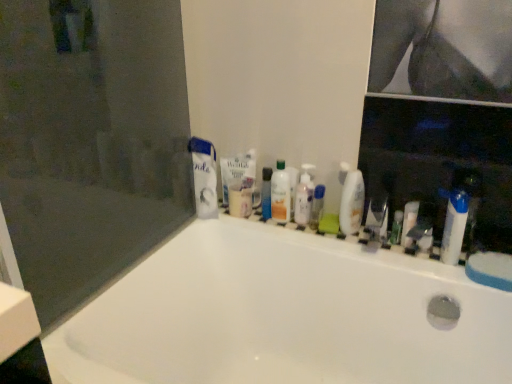
In the scene shown: Measure the distance between white matte toothpaste at upper left, the first toothpaste positioned from the left, and camera.

white matte toothpaste at upper left, the first toothpaste positioned from the left, is 1.38 meters away from camera.

Image resolution: width=512 pixels, height=384 pixels. What do you see at coordinates (421, 229) in the screenshot? I see `matte white faucet at right` at bounding box center [421, 229].

Describe the element at coordinates (409, 222) in the screenshot. The height and width of the screenshot is (384, 512). I see `white plastic toothbrush at center, which appears as the 2th toiletry when viewed from the right` at that location.

Image resolution: width=512 pixels, height=384 pixels. What are the coordinates of `white glossy ledge at upper center` in the screenshot? It's located at (365, 238).

The image size is (512, 384). What are the coordinates of `transparent glass screen door at upper left` in the screenshot? It's located at (90, 140).

I want to click on metallic silver razor at center, which appears as the 4th toiletry when viewed from the right, so click(x=377, y=218).

What is the approximate width of translucent plastic bottles at center, the fifth toiletry positioned from the right?

translucent plastic bottles at center, the fifth toiletry positioned from the right, is 3.09 inches wide.

You are a GUI agent. You are given a task and a screenshot of the screen. Output one action in this format:
    pyautogui.click(x=<x>, y=<y>)
    Task: Click on the white matte toothpaste at upper left, the first toothpaste positioned from the left
    Image resolution: width=512 pixels, height=384 pixels.
    Given the screenshot: What is the action you would take?
    pyautogui.click(x=204, y=177)

Is metallic silver razor at center, which appears as the 4th toiletry when viewed from the right, not inside transparent plastic bottle at center, positioned as the 2th mouthwash in left-to-right order?

That's correct, metallic silver razor at center, which appears as the 4th toiletry when viewed from the right, is outside of transparent plastic bottle at center, positioned as the 2th mouthwash in left-to-right order.

Is point (383, 219) closer to viewer compared to point (322, 189)?

Yes, point (383, 219) is in front of point (322, 189).

Locate an element on the screen. This screenshot has height=384, width=512. the 1st toiletry below the transparent plastic bottle at center, placed as the second mouthwash when sorted from right to left (from the image's perspective) is located at coordinates (377, 218).

Based on the photo, which is more to the left, white plastic toothbrush at center, which appears as the 2th toiletry when viewed from the right, or green matte bottle at center, marked as the third toiletry in a right-to-left arrangement?

From the viewer's perspective, green matte bottle at center, marked as the third toiletry in a right-to-left arrangement, appears more on the left side.

Does white plastic toothbrush at center, which appears as the 2th toiletry when viewed from the right, touch green matte bottle at center, positioned as the fourth toiletry in left-to-right order?

Yes, white plastic toothbrush at center, which appears as the 2th toiletry when viewed from the right, is next to green matte bottle at center, positioned as the fourth toiletry in left-to-right order.

How different are the orientations of white plastic toothbrush at center, which ranks as the 5th toiletry in left-to-right order, and green matte bottle at center, marked as the third toiletry in a right-to-left arrangement, in degrees?

The angular difference between white plastic toothbrush at center, which ranks as the 5th toiletry in left-to-right order, and green matte bottle at center, marked as the third toiletry in a right-to-left arrangement, is 0.00102 degrees.

Which of these two, white plastic toothbrush at center, which appears as the 2th toiletry when viewed from the right, or green matte bottle at center, positioned as the fourth toiletry in left-to-right order, is wider?

With larger width is white plastic toothbrush at center, which appears as the 2th toiletry when viewed from the right.

Considering the relative sizes of white plastic toothbrush at center, which appears as the 2th toiletry when viewed from the right, and white matte toothpaste at upper left, which ranks as the second toothpaste in right-to-left order, in the image provided, is white plastic toothbrush at center, which appears as the 2th toiletry when viewed from the right, smaller than white matte toothpaste at upper left, which ranks as the second toothpaste in right-to-left order,?

Correct, white plastic toothbrush at center, which appears as the 2th toiletry when viewed from the right, occupies less space than white matte toothpaste at upper left, which ranks as the second toothpaste in right-to-left order.

Considering the relative positions of white plastic toothbrush at center, which ranks as the 5th toiletry in left-to-right order, and white matte toothpaste at upper left, the first toothpaste positioned from the left, in the image provided, is white plastic toothbrush at center, which ranks as the 5th toiletry in left-to-right order, to the right of white matte toothpaste at upper left, the first toothpaste positioned from the left, from the viewer's perspective?

Yes, white plastic toothbrush at center, which ranks as the 5th toiletry in left-to-right order, is to the right of white matte toothpaste at upper left, the first toothpaste positioned from the left.

Considering the relative sizes of white plastic toothbrush at center, which appears as the 2th toiletry when viewed from the right, and white matte toothpaste at upper left, which ranks as the second toothpaste in right-to-left order, in the image provided, is white plastic toothbrush at center, which appears as the 2th toiletry when viewed from the right, shorter than white matte toothpaste at upper left, which ranks as the second toothpaste in right-to-left order,?

Correct, white plastic toothbrush at center, which appears as the 2th toiletry when viewed from the right, is not as tall as white matte toothpaste at upper left, which ranks as the second toothpaste in right-to-left order.

Is white matte toothpaste at upper left, the first toothpaste positioned from the left, at the back of white plastic toothbrush at center, which ranks as the 5th toiletry in left-to-right order?

That's not correct — white plastic toothbrush at center, which ranks as the 5th toiletry in left-to-right order, is not looking away from white matte toothpaste at upper left, the first toothpaste positioned from the left.

Does point (342, 223) lie in front of point (237, 342)?

Yes, point (342, 223) is closer to viewer.

From a real-world perspective, who is located lower, white glossy mouthwash at center, which is the 1th mouthwash in right-to-left order, or white glossy bathtub at center?

From a 3D spatial view, white glossy bathtub at center is below.

Does white glossy mouthwash at center, which is the 1th mouthwash in right-to-left order, touch white glossy bathtub at center?

white glossy mouthwash at center, which is the 1th mouthwash in right-to-left order, and white glossy bathtub at center are clearly separated.

Considering their positions, is white glossy mouthwash at center, acting as the third mouthwash starting from the left, located in front of or behind white glossy bathtub at center?

Clearly, white glossy mouthwash at center, acting as the third mouthwash starting from the left, is behind white glossy bathtub at center.

In the image, is transparent plastic bottle at center, positioned as the 2th mouthwash in left-to-right order, on the left side or the right side of white plastic toothbrush at center, which appears as the 2th toiletry when viewed from the right?

From the image, it's evident that transparent plastic bottle at center, positioned as the 2th mouthwash in left-to-right order, is to the left of white plastic toothbrush at center, which appears as the 2th toiletry when viewed from the right.

Consider the image. Is transparent plastic bottle at center, placed as the second mouthwash when sorted from right to left, further to the viewer compared to white plastic toothbrush at center, which ranks as the 5th toiletry in left-to-right order?

That is True.

Is transparent plastic bottle at center, placed as the second mouthwash when sorted from right to left, thinner than white plastic toothbrush at center, which appears as the 2th toiletry when viewed from the right?

Incorrect, the width of transparent plastic bottle at center, placed as the second mouthwash when sorted from right to left, is not less than that of white plastic toothbrush at center, which appears as the 2th toiletry when viewed from the right.

The height and width of the screenshot is (384, 512). There is a transparent plastic bottle at center, placed as the second mouthwash when sorted from right to left. Identify the location of the 2nd toiletry below it (from the image's perspective). (409, 222).

Which is correct: white plastic tube at right, which is the 6th toiletry in left-to-right order, is inside green matte bottle at center, positioned as the fourth toiletry in left-to-right order, or outside of it?

white plastic tube at right, which is the 6th toiletry in left-to-right order, cannot be found inside green matte bottle at center, positioned as the fourth toiletry in left-to-right order.

Looking at this image, considering the sizes of white plastic tube at right, which is the first toiletry from right to left, and green matte bottle at center, positioned as the fourth toiletry in left-to-right order, in the image, is white plastic tube at right, which is the first toiletry from right to left, bigger or smaller than green matte bottle at center, positioned as the fourth toiletry in left-to-right order,?

white plastic tube at right, which is the first toiletry from right to left, is bigger than green matte bottle at center, positioned as the fourth toiletry in left-to-right order.

Considering the relative sizes of white plastic tube at right, which is the first toiletry from right to left, and green matte bottle at center, positioned as the fourth toiletry in left-to-right order, in the image provided, is white plastic tube at right, which is the first toiletry from right to left, taller than green matte bottle at center, positioned as the fourth toiletry in left-to-right order,?

Yes, white plastic tube at right, which is the first toiletry from right to left, is taller than green matte bottle at center, positioned as the fourth toiletry in left-to-right order.

How different are the orientations of white plastic tube at right, which is the first toiletry from right to left, and green matte bottle at center, marked as the third toiletry in a right-to-left arrangement, in degrees?

72.8 degrees separate the facing orientations of white plastic tube at right, which is the first toiletry from right to left, and green matte bottle at center, marked as the third toiletry in a right-to-left arrangement.

Who is more distant, white glossy ledge at upper center or metallic silver razor at center, which appears as the 4th toiletry when viewed from the right?

metallic silver razor at center, which appears as the 4th toiletry when viewed from the right, is behind.

Looking at this image, could you tell me if white glossy ledge at upper center is facing metallic silver razor at center, which appears as the 4th toiletry when viewed from the right?

No, white glossy ledge at upper center is not aimed at metallic silver razor at center, which appears as the 4th toiletry when viewed from the right.

Does white glossy ledge at upper center touch metallic silver razor at center, acting as the 3th toiletry starting from the left?

No, white glossy ledge at upper center is not with metallic silver razor at center, acting as the 3th toiletry starting from the left.

At what (x,y) coordinates should I click in order to perform the action: click on ledge on the left side of metallic silver razor at center, acting as the 3th toiletry starting from the left. Please return your answer as a coordinate pair (x, y). Looking at the image, I should click on (365, 238).

At what (x,y) coordinates should I click in order to perform the action: click on mouthwash that is the 1st one when counting backward from the metallic silver razor at center, acting as the 3th toiletry starting from the left. Please return your answer as a coordinate pair (x, y). This screenshot has width=512, height=384. Looking at the image, I should click on (317, 206).

From a real-world perspective, which toiletry is the 1st one above the green matte bottle at center, positioned as the fourth toiletry in left-to-right order? Please provide its 2D coordinates.

[(409, 222)]

Based on the photo, when comparing their distances from green matte bottle at center, marked as the third toiletry in a right-to-left arrangement, does white matte toothpaste at upper center, which is counted as the first toothpaste, starting from the right, or translucent plastic mouthwash at center, which is the first mouthwash in left-to-right order, seem further?

white matte toothpaste at upper center, which is counted as the first toothpaste, starting from the right, is further to green matte bottle at center, marked as the third toiletry in a right-to-left arrangement.

When comparing their distances from transparent plastic bottle at center, placed as the second mouthwash when sorted from right to left, does white plastic tube at right, which is the first toiletry from right to left, or transparent glass screen door at upper left seem further?

Based on the image, transparent glass screen door at upper left appears to be further to transparent plastic bottle at center, placed as the second mouthwash when sorted from right to left.

Which object lies nearer to the anchor point white matte toothpaste at upper left, the first toothpaste positioned from the left, matte white faucet at right or metallic silver razor at center, which appears as the 4th toiletry when viewed from the right?

The object closer to white matte toothpaste at upper left, the first toothpaste positioned from the left, is metallic silver razor at center, which appears as the 4th toiletry when viewed from the right.

Looking at the image, which one is located closer to white plastic tube at right, which is the 6th toiletry in left-to-right order, blue plastic tube at center, the first toiletry in the left-to-right sequence, or metallic silver razor at center, which appears as the 4th toiletry when viewed from the right?

Based on the image, metallic silver razor at center, which appears as the 4th toiletry when viewed from the right, appears to be nearer to white plastic tube at right, which is the 6th toiletry in left-to-right order.

Looking at the image, which one is located further to white matte toothpaste at upper left, which ranks as the second toothpaste in right-to-left order, matte white faucet at right or green matte bottle at center, positioned as the fourth toiletry in left-to-right order?

matte white faucet at right lies further to white matte toothpaste at upper left, which ranks as the second toothpaste in right-to-left order, than the other object.

Estimate the real-world distances between objects in this image. Which object is closer to white glossy mouthwash at center, acting as the third mouthwash starting from the left, transparent plastic bottle at center, placed as the second mouthwash when sorted from right to left, or white matte toothpaste at upper left, which ranks as the second toothpaste in right-to-left order?

The object closer to white glossy mouthwash at center, acting as the third mouthwash starting from the left, is transparent plastic bottle at center, placed as the second mouthwash when sorted from right to left.

Based on their spatial positions, is matte white faucet at right or metallic silver razor at center, which appears as the 4th toiletry when viewed from the right, closer to transparent plastic bottle at center, placed as the second mouthwash when sorted from right to left?

metallic silver razor at center, which appears as the 4th toiletry when viewed from the right, lies closer to transparent plastic bottle at center, placed as the second mouthwash when sorted from right to left, than the other object.

Looking at the image, which one is located closer to matte white faucet at right, transparent plastic bottle at center, placed as the second mouthwash when sorted from right to left, or white glossy mouthwash at center, which is the 1th mouthwash in right-to-left order?

white glossy mouthwash at center, which is the 1th mouthwash in right-to-left order.

The image size is (512, 384). I want to click on screen door located between white glossy bathtub at center and green matte bottle at center, positioned as the fourth toiletry in left-to-right order, in the depth direction, so click(90, 140).

Identify the location of faucet positioned between white glossy bathtub at center and white matte toothpaste at upper left, the first toothpaste positioned from the left, from near to far. (421, 229).

You are a GUI agent. You are given a task and a screenshot of the screen. Output one action in this format:
    pyautogui.click(x=<x>, y=<y>)
    Task: Click on the toothpaste between transparent glass screen door at upper left and white matte toothpaste at upper center, which is counted as the first toothpaste, starting from the right, from front to back
    The width and height of the screenshot is (512, 384).
    Given the screenshot: What is the action you would take?
    (204, 177)

This screenshot has height=384, width=512. Find the location of `faucet situated between translucent plastic mouthwash at center, which is the first mouthwash in left-to-right order, and white plastic tube at right, which is the 6th toiletry in left-to-right order, from left to right`. faucet situated between translucent plastic mouthwash at center, which is the first mouthwash in left-to-right order, and white plastic tube at right, which is the 6th toiletry in left-to-right order, from left to right is located at coordinates 421,229.